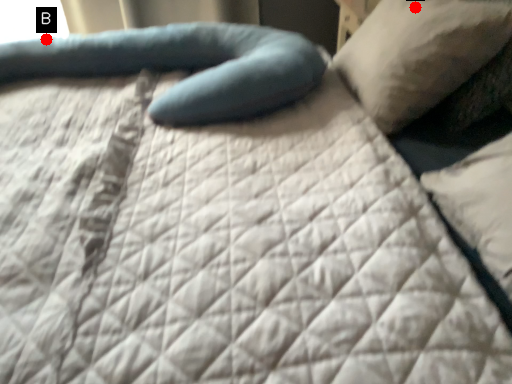
Question: Two points are circled on the image, labeled by A and B beside each circle. Which point is farther to the camera?

Choices:
 (A) A is further
 (B) B is further

Answer: (B)